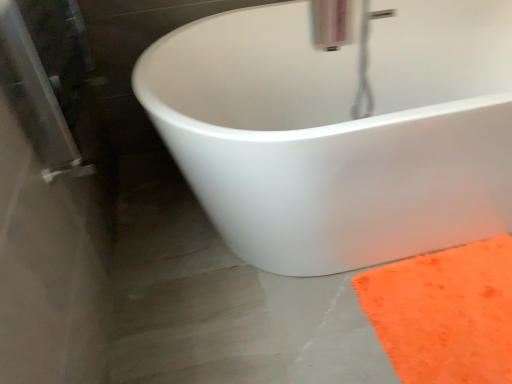
Question: Should I look upward or downward to see metallic silver faucet at upper center?

Choices:
 (A) up
 (B) down

Answer: (A)

Question: Can you confirm if orange fuzzy rug at lower right is taller than white matte bathtub at center?

Choices:
 (A) no
 (B) yes

Answer: (A)

Question: Is orange fuzzy rug at lower right smaller than white matte bathtub at center?

Choices:
 (A) no
 (B) yes

Answer: (B)

Question: Is orange fuzzy rug at lower right with white matte bathtub at center?

Choices:
 (A) no
 (B) yes

Answer: (A)

Question: Is orange fuzzy rug at lower right to the right of white matte bathtub at center from the viewer's perspective?

Choices:
 (A) no
 (B) yes

Answer: (B)

Question: Considering the relative sizes of orange fuzzy rug at lower right and white matte bathtub at center in the image provided, is orange fuzzy rug at lower right thinner than white matte bathtub at center?

Choices:
 (A) no
 (B) yes

Answer: (B)

Question: Is orange fuzzy rug at lower right turned away from white matte bathtub at center?

Choices:
 (A) yes
 (B) no

Answer: (B)

Question: Is metallic silver faucet at upper center oriented towards orange fuzzy rug at lower right?

Choices:
 (A) yes
 (B) no

Answer: (B)

Question: Considering the relative sizes of metallic silver faucet at upper center and orange fuzzy rug at lower right in the image provided, is metallic silver faucet at upper center thinner than orange fuzzy rug at lower right?

Choices:
 (A) no
 (B) yes

Answer: (B)

Question: Is metallic silver faucet at upper center not close to orange fuzzy rug at lower right?

Choices:
 (A) no
 (B) yes

Answer: (A)

Question: Is metallic silver faucet at upper center not inside orange fuzzy rug at lower right?

Choices:
 (A) yes
 (B) no

Answer: (A)

Question: Does metallic silver faucet at upper center have a smaller size compared to orange fuzzy rug at lower right?

Choices:
 (A) no
 (B) yes

Answer: (A)

Question: Does metallic silver faucet at upper center appear on the right side of orange fuzzy rug at lower right?

Choices:
 (A) no
 (B) yes

Answer: (A)

Question: Would you consider white matte bathtub at center to be distant from orange fuzzy rug at lower right?

Choices:
 (A) no
 (B) yes

Answer: (A)